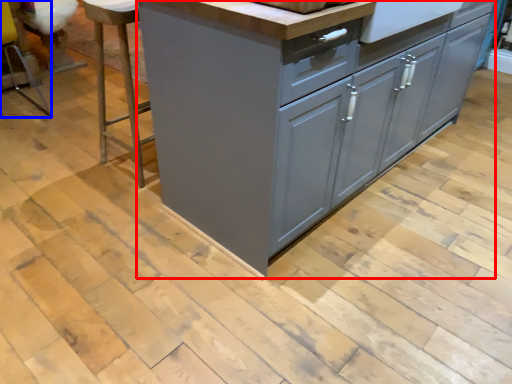
Question: Which object appears closest to the camera in this image, chest of drawers (highlighted by a red box) or bar stool (highlighted by a blue box)?

Choices:
 (A) chest of drawers
 (B) bar stool

Answer: (A)